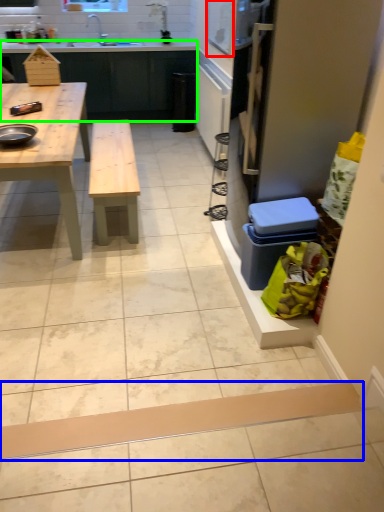
Question: Which object is the farthest from window screen (highlighted by a red box)? Choose among these: plank (highlighted by a blue box) or counter (highlighted by a green box).

Choices:
 (A) plank
 (B) counter

Answer: (A)